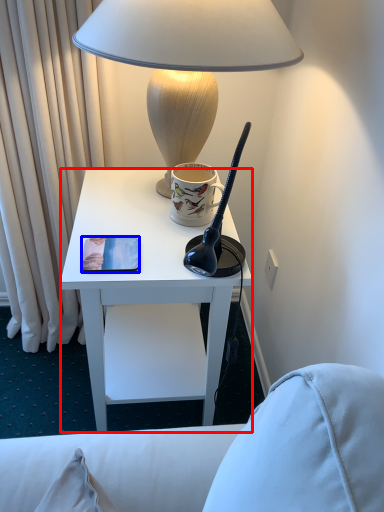
Question: Which of the following is the closest to the observer, desk (highlighted by a red box) or pad (highlighted by a blue box)?

Choices:
 (A) desk
 (B) pad

Answer: (A)